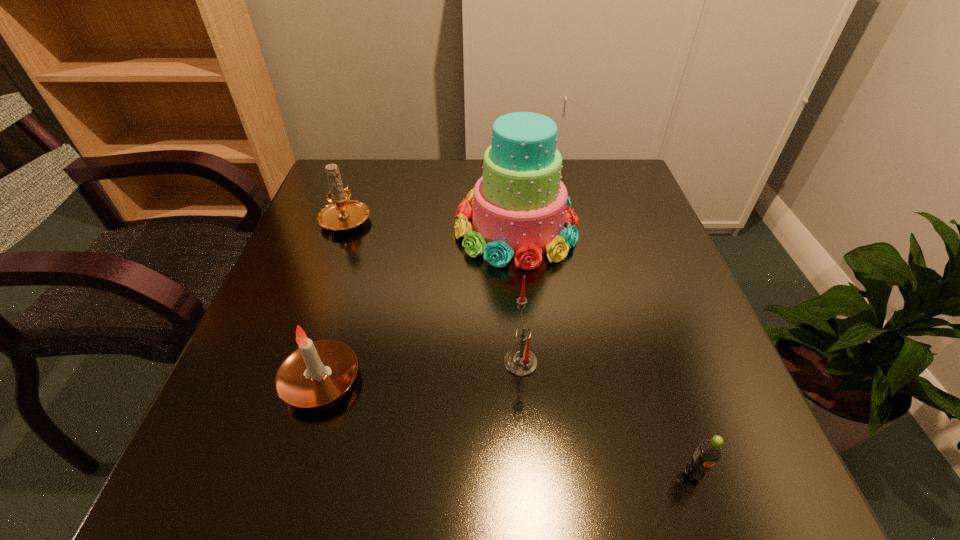
The width and height of the screenshot is (960, 540). What are the coordinates of `blank space at the near left corner of the desktop` in the screenshot? It's located at (247, 456).

The height and width of the screenshot is (540, 960). I want to click on vacant space at the far right corner of the desktop, so click(x=604, y=168).

Locate an element on the screen. The height and width of the screenshot is (540, 960). vacant space at the near right corner of the desktop is located at coordinates (745, 462).

Where is `vacant space that is in between the tallest object and the shortest object`? This screenshot has width=960, height=540. vacant space that is in between the tallest object and the shortest object is located at coordinates (604, 350).

Find the location of a particular element. The height and width of the screenshot is (540, 960). blank region between the cake and the rightmost object is located at coordinates (604, 350).

Locate an element on the screen. The width and height of the screenshot is (960, 540). free spot between the cake and the farthest candle is located at coordinates (431, 222).

Where is `empty space that is in between the tallest object and the rightmost candle`? The width and height of the screenshot is (960, 540). empty space that is in between the tallest object and the rightmost candle is located at coordinates (518, 295).

This screenshot has height=540, width=960. I want to click on vacant area between the farthest candle and the tallest object, so point(431,222).

At what (x,y) coordinates should I click in order to perform the action: click on vacant area between the rightmost candle and the nearest object. Please return your answer as a coordinate pair (x, y). Looking at the image, I should click on (607, 418).

You are a GUI agent. You are given a task and a screenshot of the screen. Output one action in this format:
    pyautogui.click(x=<x>, y=<y>)
    Task: Click on the object identified as the second closest to the farthest candle
    
    Given the screenshot: What is the action you would take?
    pyautogui.click(x=316, y=373)